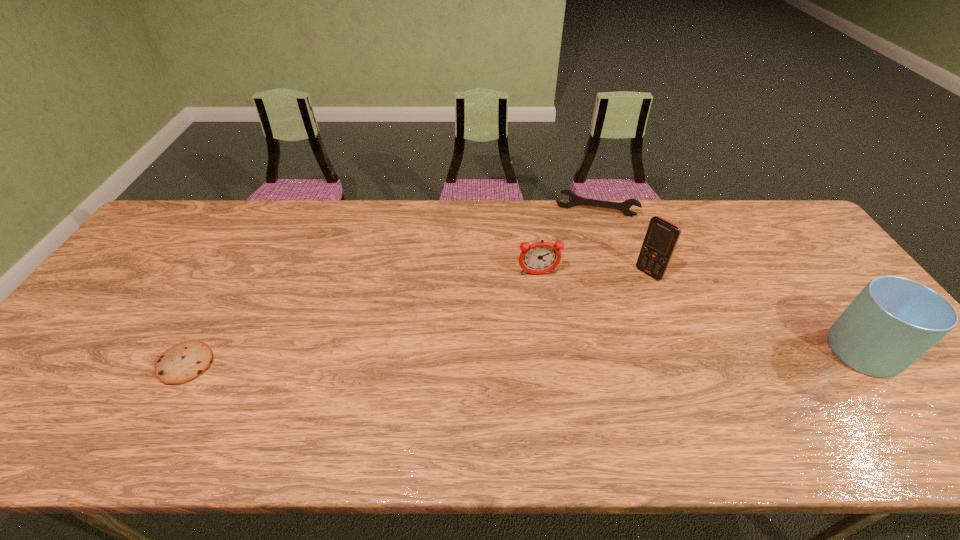
Locate an element on the screen. The image size is (960, 540). free space in the image that satisfies the following two spatial constraints: 1. on the back side of the leftmost object; 2. on the right side of the mug is located at coordinates (193, 352).

Locate an element on the screen. free space that satisfies the following two spatial constraints: 1. on the back side of the third shortest object; 2. on the right side of the cellular telephone is located at coordinates (539, 273).